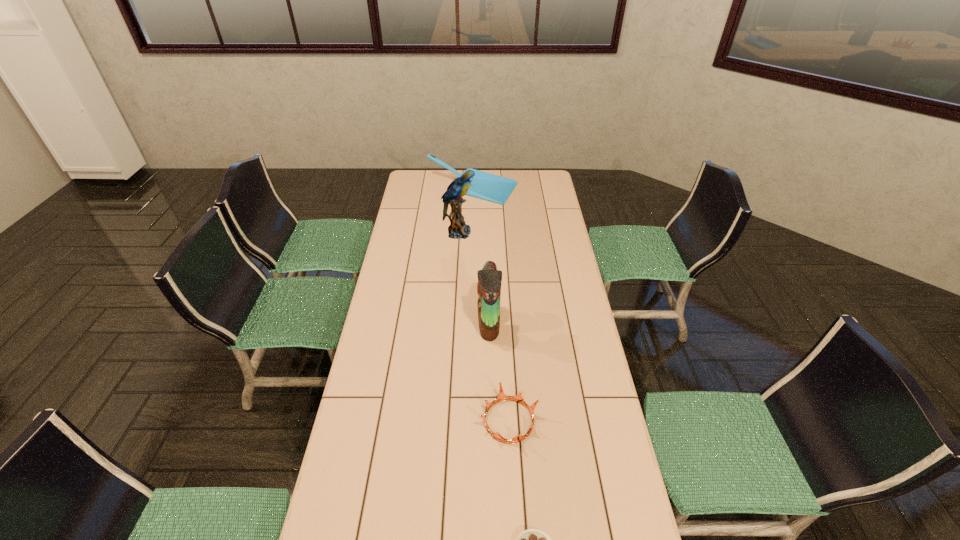
Where is `vacant space located at the face of the third farthest object`? vacant space located at the face of the third farthest object is located at coordinates (395, 323).

This screenshot has height=540, width=960. Identify the location of vacant point located at the face of the third farthest object. [400, 323].

Identify the location of vacant space located on the right of the third tallest object. (537, 190).

Where is `free location located on the left of the fourth tallest object`? The height and width of the screenshot is (540, 960). free location located on the left of the fourth tallest object is located at coordinates (411, 421).

Locate an element on the screen. The width and height of the screenshot is (960, 540). object situated at the far edge is located at coordinates (484, 185).

Where is `object at the left edge`? object at the left edge is located at coordinates (484, 185).

Where is `object that is at the far left corner`? This screenshot has height=540, width=960. object that is at the far left corner is located at coordinates (484, 185).

Image resolution: width=960 pixels, height=540 pixels. I want to click on free space at the far edge of the desktop, so click(492, 171).

Find the location of a particular element. The height and width of the screenshot is (540, 960). vacant space at the left edge of the desktop is located at coordinates (393, 311).

In the image, there is a desktop. Find the location of `vacant space at the right edge`. vacant space at the right edge is located at coordinates (587, 431).